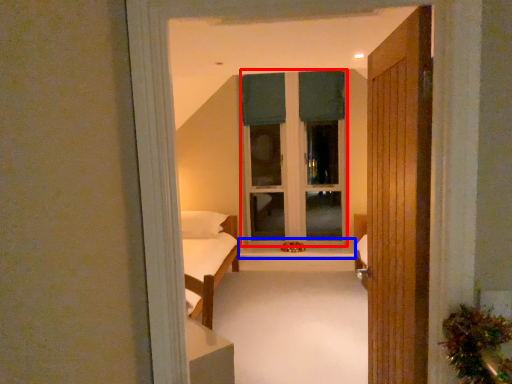
Question: Among these objects, which one is nearest to the camera, window frame (highlighted by a red box) or window sill (highlighted by a blue box)?

Choices:
 (A) window frame
 (B) window sill

Answer: (B)